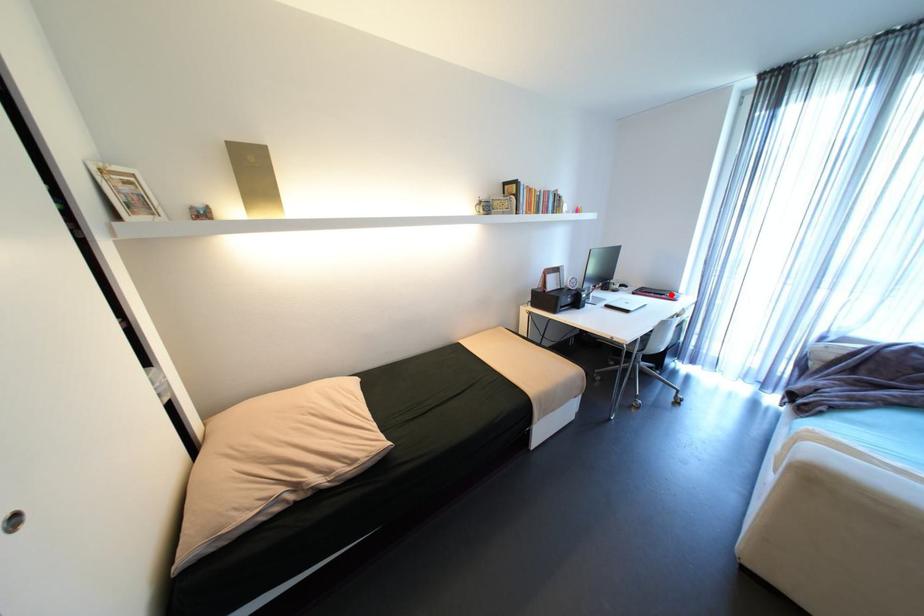
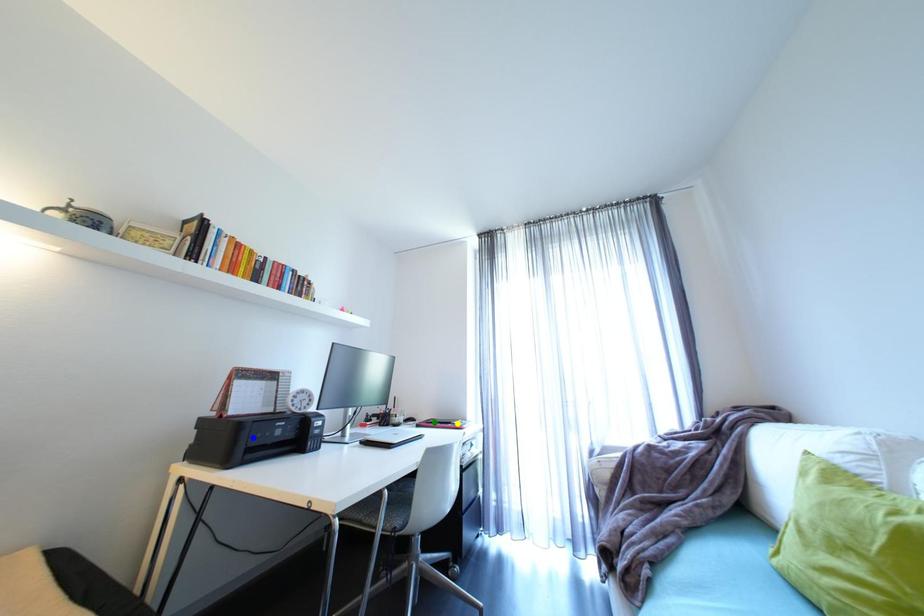
Question: I am providing you with two images of the same scene from different viewpoints. A red point is marked on the first image. You are given multiple points on the second image. Can you choose the point in image 2 that corresponds to the point in image 1?

Choices:
 (A) blue point
 (B) green point
 (C) yellow point

Answer: (C)